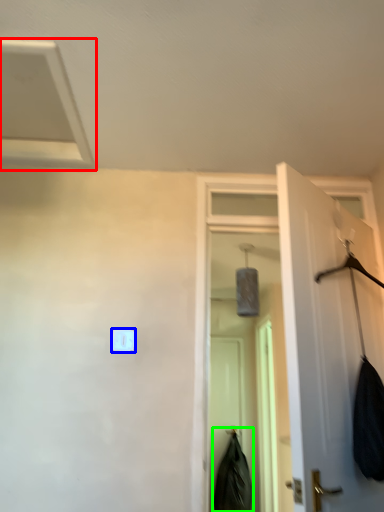
Question: Which is nearer to the exhaust hood (highlighted by a red box)? light switch (highlighted by a blue box) or clothing (highlighted by a green box).

Choices:
 (A) light switch
 (B) clothing

Answer: (A)